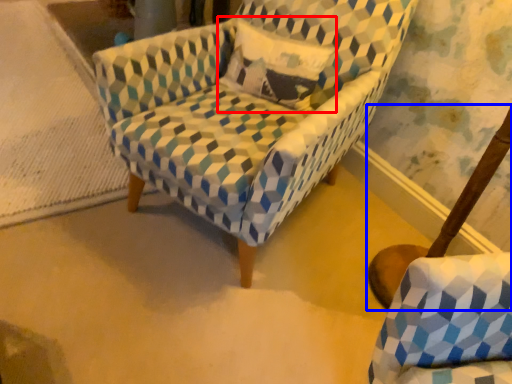
Question: Which point is further to the camera, throw pillow (highlighted by a red box) or swivel chair (highlighted by a blue box)?

Choices:
 (A) throw pillow
 (B) swivel chair

Answer: (B)